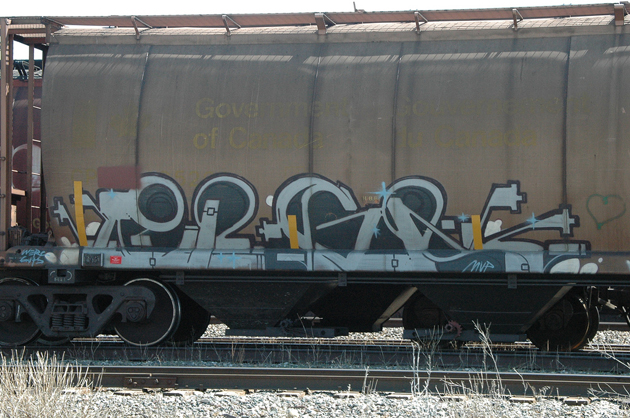
You are a GUI agent. You are given a task and a screenshot of the screen. Output one action in this format:
    pyautogui.click(x=<x>, y=<y>)
    Task: Click on the ladder
    This screenshot has height=418, width=630.
    Given the screenshot: What is the action you would take?
    pyautogui.click(x=30, y=133)